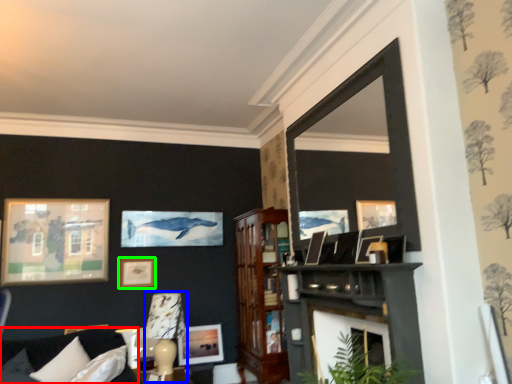
Question: Which object is positioned farthest from couch (highlighted by a red box)? Select from lamp (highlighted by a blue box) and picture frame (highlighted by a green box).

Choices:
 (A) lamp
 (B) picture frame

Answer: (B)